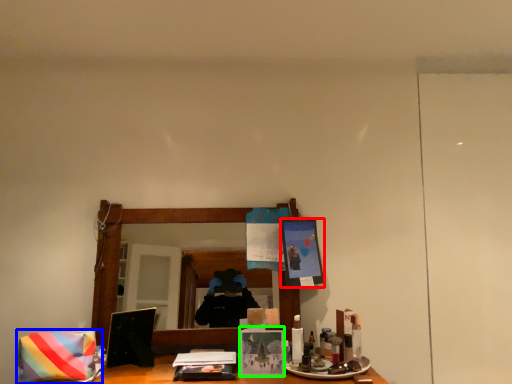
Question: Estimate the real-world distances between objects in this image. Which object is farther from picture frame (highlighted by a red box), material (highlighted by a blue box) or picture frame (highlighted by a green box)?

Choices:
 (A) material
 (B) picture frame

Answer: (A)